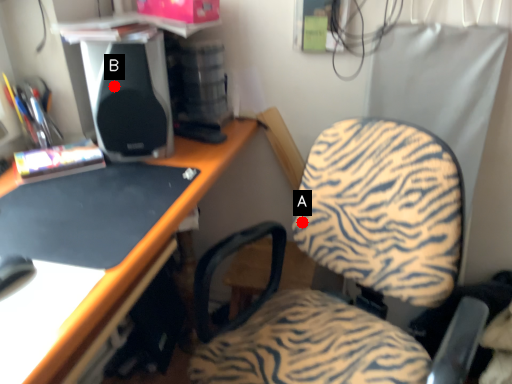
Question: Two points are circled on the image, labeled by A and B beside each circle. Which of the following is the farthest from the observer?

Choices:
 (A) A is further
 (B) B is further

Answer: (A)